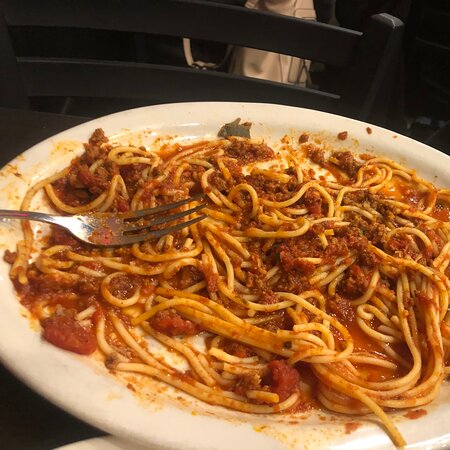
Identify the location of table. (36, 429).